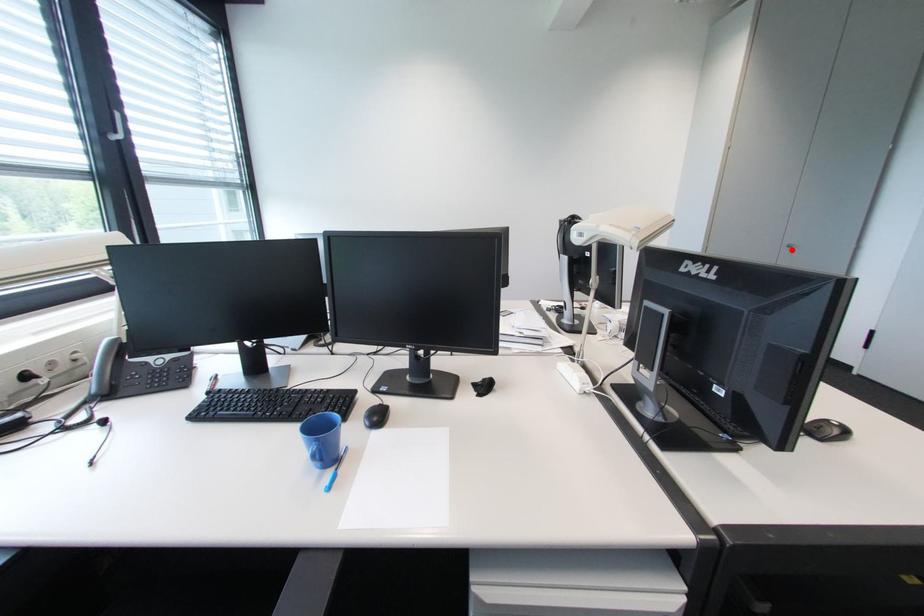
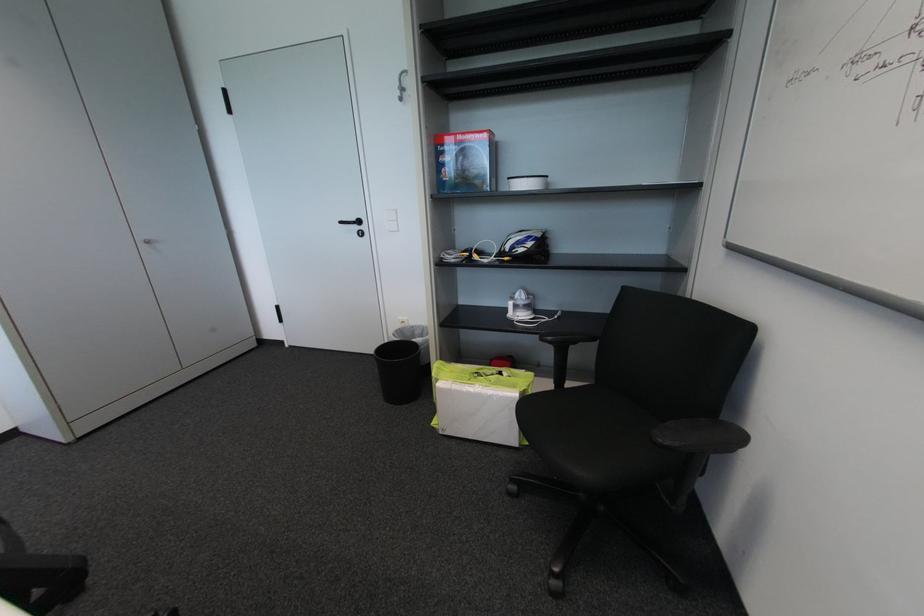
Where in the second image is the point corresponding to the highlighted location from the first image?

(151, 246)